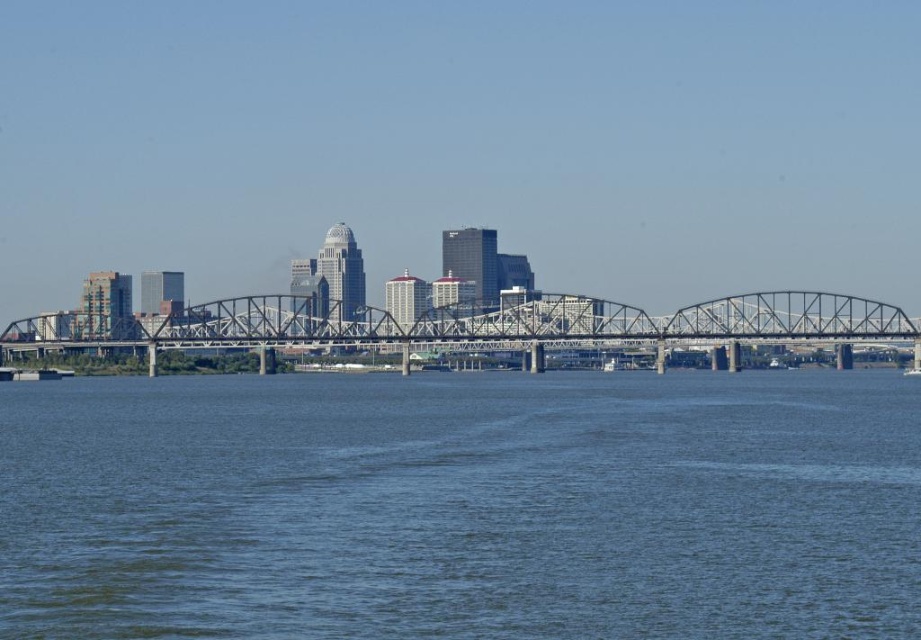
You are a drone operator planning to capture aerial footage of the city skyline. Your drone has a maximum flight range of 1000 feet. If you are positioned at the camera location, can your drone reach the point at coordinates point (x=521, y=541) without exceeding its range?

The distance of point (x=521, y=541) from the camera is 1113.30 feet, which exceeds the drone 1000 feet range. Therefore, the drone cannot reach the point without exceeding its range.

You are a photographer planning to capture a shot of the blue water at center and the metallic gray bridge at center. Based on the scene description, which object is positioned to the left of the other?

The blue water at center is to the left of the metallic gray bridge at center.

You are a photographer planning to capture the city skyline and the bridge in a single shot. Given that the blue water at center and the metallic gray bridge at center are both in your frame, which object appears taller in the photograph?

The blue water at center appears taller than the metallic gray bridge at center in the photograph.